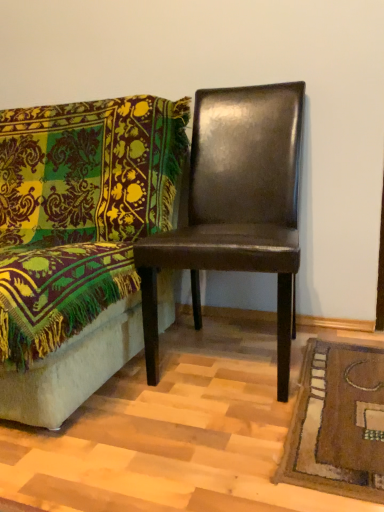
Measure the distance between point (39, 326) and camera.

They are 94.80 centimeters apart.

Locate an element on the screen. shiny brown leather chair at right, which is the 1th chair in left-to-right order is located at coordinates (79, 243).

Image resolution: width=384 pixels, height=512 pixels. What do you see at coordinates (79, 243) in the screenshot?
I see `shiny brown leather chair at right, which is the 1th chair in left-to-right order` at bounding box center [79, 243].

How much space does shiny brown leather chair at right, which is the second chair in right-to-left order, occupy vertically?

shiny brown leather chair at right, which is the second chair in right-to-left order, is 94.53 centimeters in height.

Based on the photo, how much space does shiny brown leather chair at center, which is the second chair in left-to-right order, occupy vertically?

It is 96.87 centimeters.

What do you see at coordinates (235, 207) in the screenshot? The height and width of the screenshot is (512, 384). I see `shiny brown leather chair at center, placed as the 1th chair when sorted from right to left` at bounding box center [235, 207].

Identify the location of shiny brown leather chair at center, placed as the 1th chair when sorted from right to left. The height and width of the screenshot is (512, 384). (235, 207).

Identify the location of shiny brown leather chair at right, which is the second chair in right-to-left order. (79, 243).

Considering the positions of objects shiny brown leather chair at right, which is the second chair in right-to-left order, and shiny brown leather chair at center, placed as the 1th chair when sorted from right to left, in the image provided, who is more to the left, shiny brown leather chair at right, which is the second chair in right-to-left order, or shiny brown leather chair at center, placed as the 1th chair when sorted from right to left,?

From the viewer's perspective, shiny brown leather chair at right, which is the second chair in right-to-left order, appears more on the left side.

Considering their positions, is shiny brown leather chair at right, which is the second chair in right-to-left order, located in front of or behind shiny brown leather chair at center, placed as the 1th chair when sorted from right to left?

In the image, shiny brown leather chair at right, which is the second chair in right-to-left order, appears in front of shiny brown leather chair at center, placed as the 1th chair when sorted from right to left.

Is point (25, 199) positioned in front of point (278, 308)?

No, it is not.

From the image's perspective, between shiny brown leather chair at right, which is the 1th chair in left-to-right order, and shiny brown leather chair at center, placed as the 1th chair when sorted from right to left, who is located below?

shiny brown leather chair at right, which is the 1th chair in left-to-right order, is shown below in the image.

From a real-world perspective, is shiny brown leather chair at right, which is the second chair in right-to-left order, positioned above or below shiny brown leather chair at center, which is the second chair in left-to-right order?

shiny brown leather chair at right, which is the second chair in right-to-left order, is situated lower than shiny brown leather chair at center, which is the second chair in left-to-right order, in the real world.

Considering the sizes of objects shiny brown leather chair at right, which is the second chair in right-to-left order, and shiny brown leather chair at center, placed as the 1th chair when sorted from right to left, in the image provided, who is wider, shiny brown leather chair at right, which is the second chair in right-to-left order, or shiny brown leather chair at center, placed as the 1th chair when sorted from right to left,?

shiny brown leather chair at right, which is the second chair in right-to-left order.

Consider the image. Can you confirm if shiny brown leather chair at right, which is the second chair in right-to-left order, is shorter than shiny brown leather chair at center, placed as the 1th chair when sorted from right to left?

Indeed, shiny brown leather chair at right, which is the second chair in right-to-left order, has a lesser height compared to shiny brown leather chair at center, placed as the 1th chair when sorted from right to left.

Is shiny brown leather chair at right, which is the 1th chair in left-to-right order, smaller than shiny brown leather chair at center, placed as the 1th chair when sorted from right to left?

Actually, shiny brown leather chair at right, which is the 1th chair in left-to-right order, might be larger than shiny brown leather chair at center, placed as the 1th chair when sorted from right to left.

Is shiny brown leather chair at right, which is the 1th chair in left-to-right order, located outside shiny brown leather chair at center, placed as the 1th chair when sorted from right to left?

shiny brown leather chair at right, which is the 1th chair in left-to-right order, lies outside shiny brown leather chair at center, placed as the 1th chair when sorted from right to left,'s area.

Is the surface of shiny brown leather chair at right, which is the second chair in right-to-left order, in direct contact with shiny brown leather chair at center, placed as the 1th chair when sorted from right to left?

No, shiny brown leather chair at right, which is the second chair in right-to-left order, is not beside shiny brown leather chair at center, placed as the 1th chair when sorted from right to left.

Could you tell me if shiny brown leather chair at right, which is the second chair in right-to-left order, is turned towards shiny brown leather chair at center, which is the second chair in left-to-right order?

No, shiny brown leather chair at right, which is the second chair in right-to-left order, is not facing towards shiny brown leather chair at center, which is the second chair in left-to-right order.

What's the angular difference between shiny brown leather chair at right, which is the 1th chair in left-to-right order, and shiny brown leather chair at center, which is the second chair in left-to-right order,'s facing directions?

They differ by 3.18 degrees in their facing directions.

You are a GUI agent. You are given a task and a screenshot of the screen. Output one action in this format:
    pyautogui.click(x=<x>, y=<y>)
    Task: Click on the chair that appears above the shiny brown leather chair at right, which is the 1th chair in left-to-right order (from a real-world perspective)
    
    Given the screenshot: What is the action you would take?
    pyautogui.click(x=235, y=207)

Is shiny brown leather chair at center, placed as the 1th chair when sorted from right to left, to the right of shiny brown leather chair at right, which is the 1th chair in left-to-right order, from the viewer's perspective?

Correct, you'll find shiny brown leather chair at center, placed as the 1th chair when sorted from right to left, to the right of shiny brown leather chair at right, which is the 1th chair in left-to-right order.

Which object is further away from the camera, shiny brown leather chair at center, which is the second chair in left-to-right order, or shiny brown leather chair at right, which is the 1th chair in left-to-right order?

shiny brown leather chair at center, which is the second chair in left-to-right order, is more distant.

In the scene shown: Which is less distant, (288, 183) or (65, 368)?

Positioned in front is point (65, 368).

From the image's perspective, is shiny brown leather chair at center, which is the second chair in left-to-right order, below shiny brown leather chair at right, which is the second chair in right-to-left order?

No, from the image's perspective, shiny brown leather chair at center, which is the second chair in left-to-right order, is not below shiny brown leather chair at right, which is the second chair in right-to-left order.

From a real-world perspective, who is located higher, shiny brown leather chair at center, placed as the 1th chair when sorted from right to left, or shiny brown leather chair at right, which is the 1th chair in left-to-right order?

shiny brown leather chair at center, placed as the 1th chair when sorted from right to left.

Can you confirm if shiny brown leather chair at center, which is the second chair in left-to-right order, is wider than shiny brown leather chair at right, which is the 1th chair in left-to-right order?

Incorrect, the width of shiny brown leather chair at center, which is the second chair in left-to-right order, does not surpass that of shiny brown leather chair at right, which is the 1th chair in left-to-right order.

Who is taller, shiny brown leather chair at center, placed as the 1th chair when sorted from right to left, or shiny brown leather chair at right, which is the 1th chair in left-to-right order?

shiny brown leather chair at center, placed as the 1th chair when sorted from right to left, is taller.

Which of these two, shiny brown leather chair at center, which is the second chair in left-to-right order, or shiny brown leather chair at right, which is the 1th chair in left-to-right order, is bigger?

Bigger between the two is shiny brown leather chair at right, which is the 1th chair in left-to-right order.

Is shiny brown leather chair at right, which is the 1th chair in left-to-right order, surrounded by shiny brown leather chair at center, which is the second chair in left-to-right order?

No, shiny brown leather chair at center, which is the second chair in left-to-right order, does not contain shiny brown leather chair at right, which is the 1th chair in left-to-right order.

Is shiny brown leather chair at center, which is the second chair in left-to-right order, far away from shiny brown leather chair at right, which is the second chair in right-to-left order?

They are positioned close to each other.

Is shiny brown leather chair at center, which is the second chair in left-to-right order, aimed at shiny brown leather chair at right, which is the second chair in right-to-left order?

No, shiny brown leather chair at center, which is the second chair in left-to-right order, is not turned towards shiny brown leather chair at right, which is the second chair in right-to-left order.

How many degrees apart are the facing directions of shiny brown leather chair at center, which is the second chair in left-to-right order, and shiny brown leather chair at right, which is the 1th chair in left-to-right order?

The angle between the facing direction of shiny brown leather chair at center, which is the second chair in left-to-right order, and the facing direction of shiny brown leather chair at right, which is the 1th chair in left-to-right order, is 3.18 degrees.

The width and height of the screenshot is (384, 512). In order to click on chair lying above the shiny brown leather chair at right, which is the 1th chair in left-to-right order (from the image's perspective) in this screenshot , I will do `click(235, 207)`.

Locate an element on the screen. This screenshot has height=512, width=384. chair located below the shiny brown leather chair at center, which is the second chair in left-to-right order (from the image's perspective) is located at coordinates (79, 243).

Locate an element on the screen. This screenshot has width=384, height=512. chair above the shiny brown leather chair at right, which is the 1th chair in left-to-right order (from the image's perspective) is located at coordinates (235, 207).